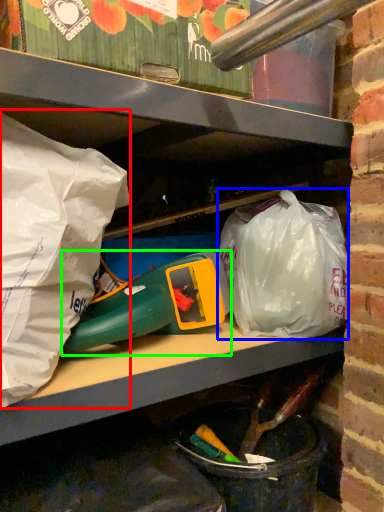
Question: Estimate the real-world distances between objects in this image. Which object is closer to plastic bag (highlighted by a red box), plastic bag (highlighted by a blue box) or toy (highlighted by a green box)?

Choices:
 (A) plastic bag
 (B) toy

Answer: (B)